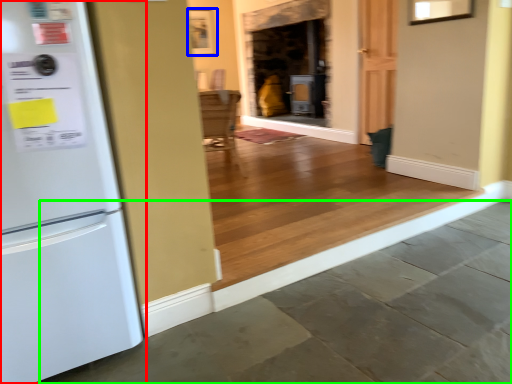
Question: Which object is the farthest from refrigerator (highlighted by a red box)? Choose among these: picture frame (highlighted by a blue box) or concrete (highlighted by a green box).

Choices:
 (A) picture frame
 (B) concrete

Answer: (A)